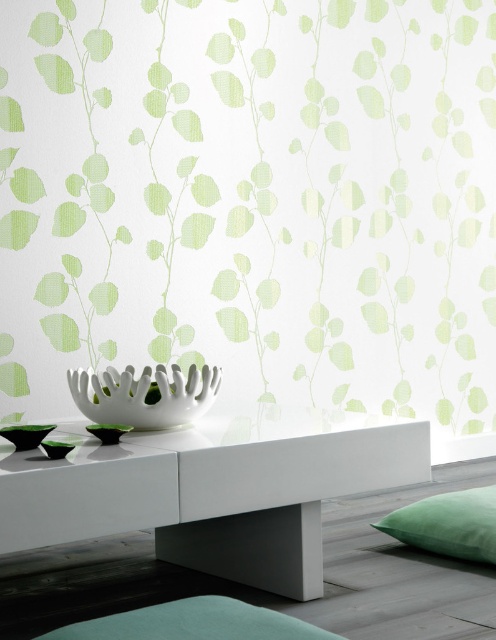
Question: Does green leafy wallpaper at upper center appear under green velvet cushion at lower right?

Choices:
 (A) no
 (B) yes

Answer: (A)

Question: Which object appears closest to the camera in this image?

Choices:
 (A) green velvet cushion at lower right
 (B) green leafy wallpaper at upper center

Answer: (A)

Question: Does green leafy wallpaper at upper center have a greater width compared to white glossy table at lower center?

Choices:
 (A) yes
 (B) no

Answer: (A)

Question: Can you confirm if green leafy wallpaper at upper center is bigger than teal fabric mat at lower center?

Choices:
 (A) no
 (B) yes

Answer: (B)

Question: Estimate the real-world distances between objects in this image. Which object is closer to the teal fabric mat at lower center?

Choices:
 (A) white glossy table at lower center
 (B) green velvet cushion at lower right
 (C) green leafy wallpaper at upper center

Answer: (A)

Question: Estimate the real-world distances between objects in this image. Which object is closer to the green leafy wallpaper at upper center?

Choices:
 (A) green velvet cushion at lower right
 (B) white glossy table at lower center

Answer: (B)